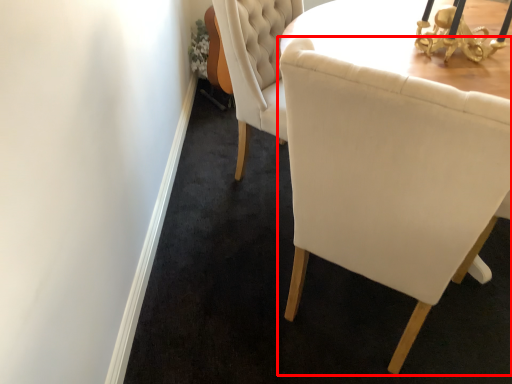
Question: Where is chair (annotated by the red box) located in relation to table lamp in the image?

Choices:
 (A) right
 (B) left

Answer: (B)